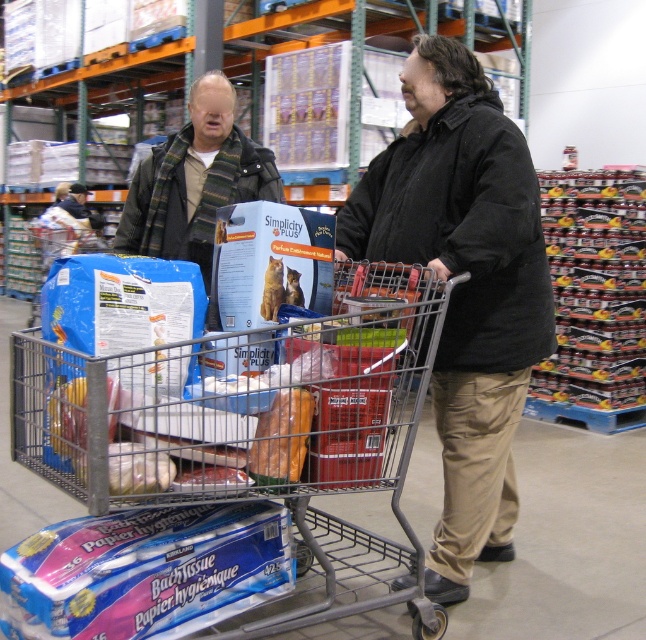
Does metallic gray trolley at center appear over black matte jacket at center?

No, metallic gray trolley at center is not above black matte jacket at center.

Measure the distance between point [50,598] and camera.

Point [50,598] is 1.57 meters away from camera.

Is point (110, 292) positioned behind point (550, 324)?

No, it is in front of (550, 324).

Locate an element on the screen. Image resolution: width=646 pixels, height=640 pixels. metallic gray trolley at center is located at coordinates (222, 472).

Can you confirm if black matte jacket at center is positioned to the left of brown leather wallet at center?

Incorrect, black matte jacket at center is not on the left side of brown leather wallet at center.

Is point (510, 256) positioned before point (302, 410)?

No.

Is point (417, 65) in front of point (276, 448)?

No, (417, 65) is further to viewer.

At what (x,y) coordinates should I click in order to perform the action: click on black matte jacket at center. Please return your answer as a coordinate pair (x, y). Image resolution: width=646 pixels, height=640 pixels. Looking at the image, I should click on (463, 285).

Measure the distance between metallic gray trolley at center and camera.

They are 5.12 feet apart.

Is metallic gray trolley at center in front of brown leather wallet at center?

Yes, metallic gray trolley at center is in front of brown leather wallet at center.

Find the location of `metallic gray trolley at center`. metallic gray trolley at center is located at coordinates click(222, 472).

Identify the location of metallic gray trolley at center. Image resolution: width=646 pixels, height=640 pixels. (222, 472).